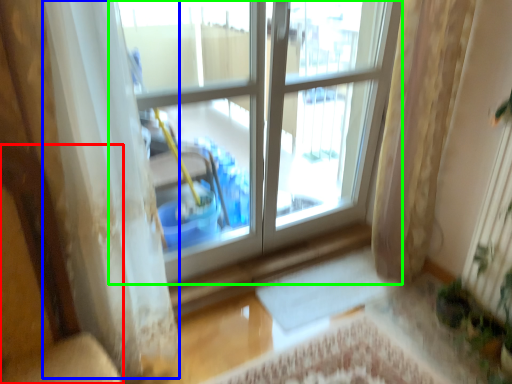
Question: Which object is the closest to the armchair (highlighted by a red box)? Choose among these: curtain (highlighted by a blue box) or window (highlighted by a green box).

Choices:
 (A) curtain
 (B) window

Answer: (A)